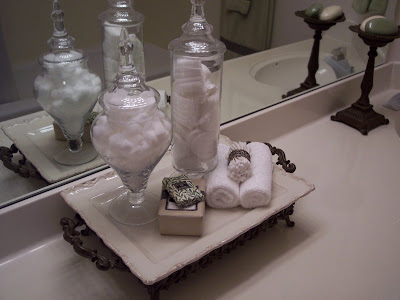
Where is `glass container of cotton ball`? This screenshot has height=300, width=400. glass container of cotton ball is located at coordinates (131, 92).